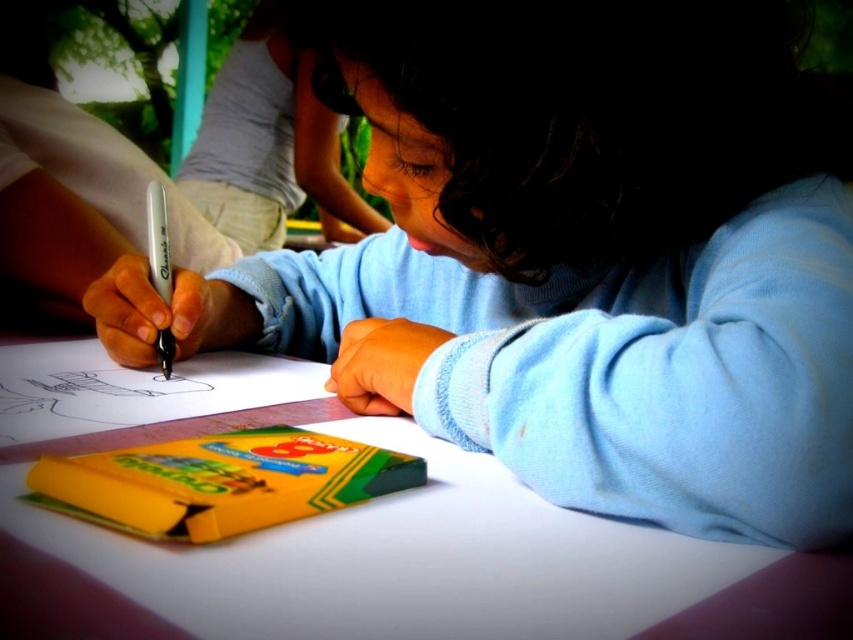
From the picture: You are a teacher observing a child drawing at a table. You notice the white paper at center and the white matte pen at center. Which object is longer?

The white matte pen at center is longer than the white paper at center.

You are a parent observing your child drawing at a table. You notice two points on the paper where the child has placed their markers. The first point is at coordinates point (708, 570) and the second is at point (149, 236). From your perspective, which point is closer to the child?

Point (708, 570) is in front of point (149, 236), so it is closer to the child.